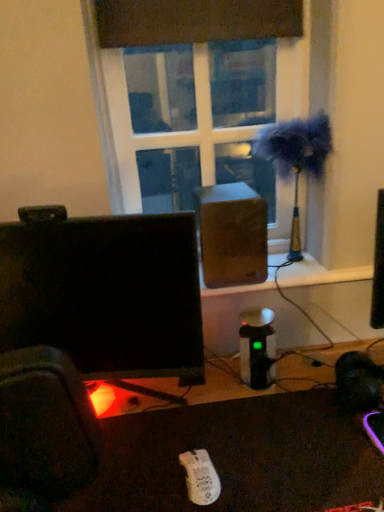
Find the location of a particular element. free space behind white matte wii controller at lower center is located at coordinates (199, 429).